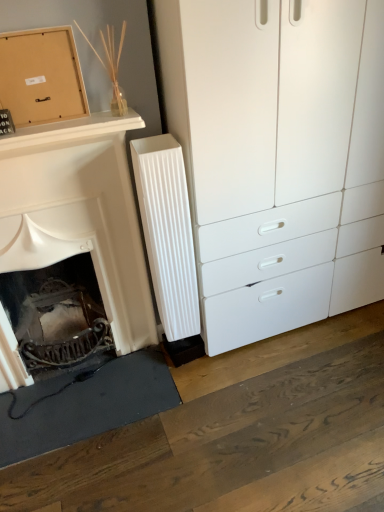
Question: Considering the relative sizes of matte cardboard box at upper left and white matte fireplace at left in the image provided, is matte cardboard box at upper left wider than white matte fireplace at left?

Choices:
 (A) yes
 (B) no

Answer: (B)

Question: Is the position of matte cardboard box at upper left less distant than that of white matte fireplace at left?

Choices:
 (A) no
 (B) yes

Answer: (A)

Question: Can you confirm if matte cardboard box at upper left is smaller than white matte fireplace at left?

Choices:
 (A) yes
 (B) no

Answer: (A)

Question: Could white matte fireplace at left be considered to be inside matte cardboard box at upper left?

Choices:
 (A) yes
 (B) no

Answer: (B)

Question: Is matte cardboard box at upper left facing towards white matte fireplace at left?

Choices:
 (A) yes
 (B) no

Answer: (B)

Question: Does matte cardboard box at upper left come behind white matte fireplace at left?

Choices:
 (A) no
 (B) yes

Answer: (B)

Question: Can you confirm if white ribbed radiator at center is positioned to the left of white matte fireplace at left?

Choices:
 (A) no
 (B) yes

Answer: (A)

Question: Is white ribbed radiator at center thinner than white matte fireplace at left?

Choices:
 (A) no
 (B) yes

Answer: (B)

Question: Considering the relative positions of white ribbed radiator at center and white matte fireplace at left in the image provided, is white ribbed radiator at center in front of white matte fireplace at left?

Choices:
 (A) yes
 (B) no

Answer: (B)

Question: Is white ribbed radiator at center surrounding white matte fireplace at left?

Choices:
 (A) yes
 (B) no

Answer: (B)

Question: From a real-world perspective, is white ribbed radiator at center under white matte fireplace at left?

Choices:
 (A) yes
 (B) no

Answer: (A)

Question: Is white ribbed radiator at center not inside white matte fireplace at left?

Choices:
 (A) yes
 (B) no

Answer: (A)

Question: From a real-world perspective, is white ribbed radiator at center under matte cardboard box at upper left?

Choices:
 (A) no
 (B) yes

Answer: (B)